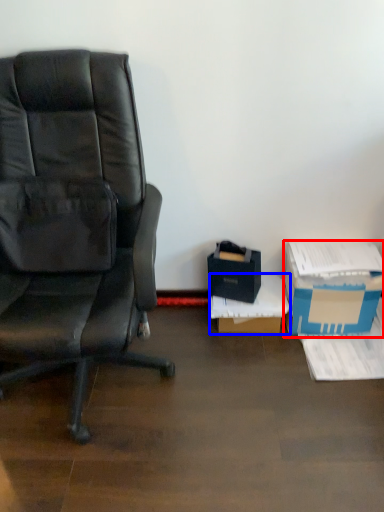
Question: Among these objects, which one is nearest to the camera, box (highlighted by a red box) or box (highlighted by a blue box)?

Choices:
 (A) box
 (B) box

Answer: (A)